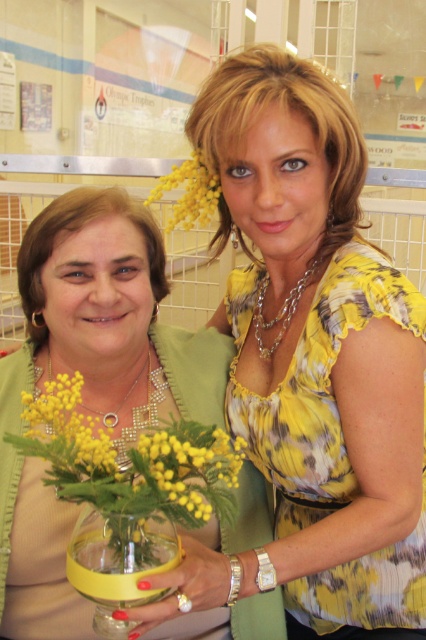
Question: Which object is positioned closest to the transparent glass vase at center?

Choices:
 (A) matte green dress at center
 (B) yellow fluffy flower at upper center
 (C) yellow matte flowers at center

Answer: (C)

Question: Based on their relative distances, which object is nearer to the yellow matte flowers at center?

Choices:
 (A) transparent glass vase at center
 (B) matte green dress at center
 (C) yellow fluffy flower at upper center

Answer: (A)

Question: Can you confirm if matte green dress at center is positioned to the right of yellow matte flowers at center?

Choices:
 (A) no
 (B) yes

Answer: (A)

Question: Is transparent glass vase at center below yellow fluffy flower at upper center?

Choices:
 (A) no
 (B) yes

Answer: (B)

Question: Which object appears farthest from the camera in this image?

Choices:
 (A) matte green dress at center
 (B) yellow fluffy flower at upper center
 (C) transparent glass vase at center
 (D) yellow matte flowers at center

Answer: (B)

Question: Can you confirm if matte green dress at center is smaller than yellow matte flowers at center?

Choices:
 (A) no
 (B) yes

Answer: (A)